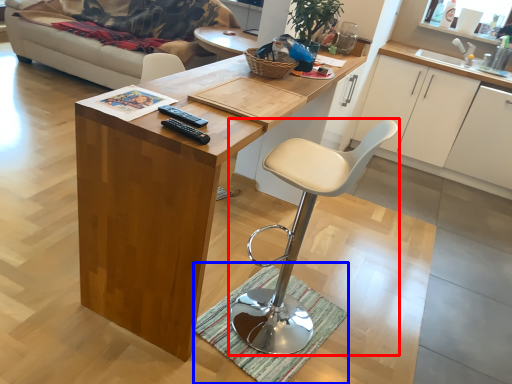
Question: Which object is further to the camera taking this photo, chair (highlighted by a red box) or doormat (highlighted by a blue box)?

Choices:
 (A) chair
 (B) doormat

Answer: (B)